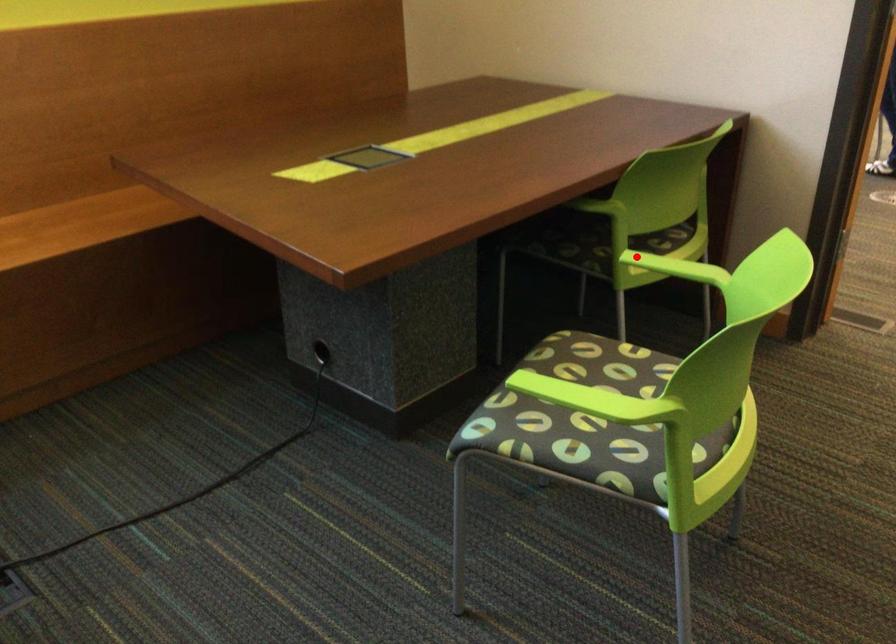
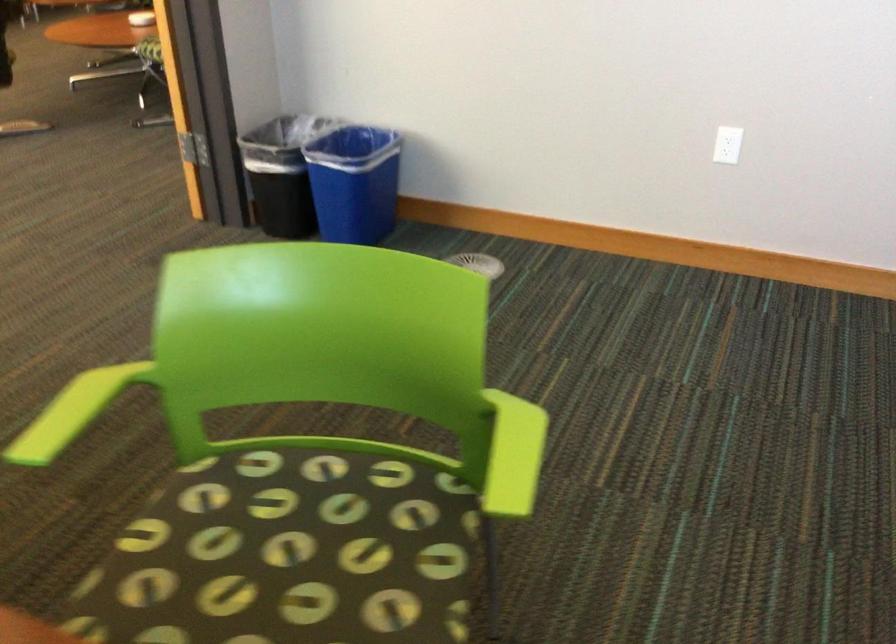
In the second image, find the point that corresponds to the highlighted location in the first image.

(55, 429)